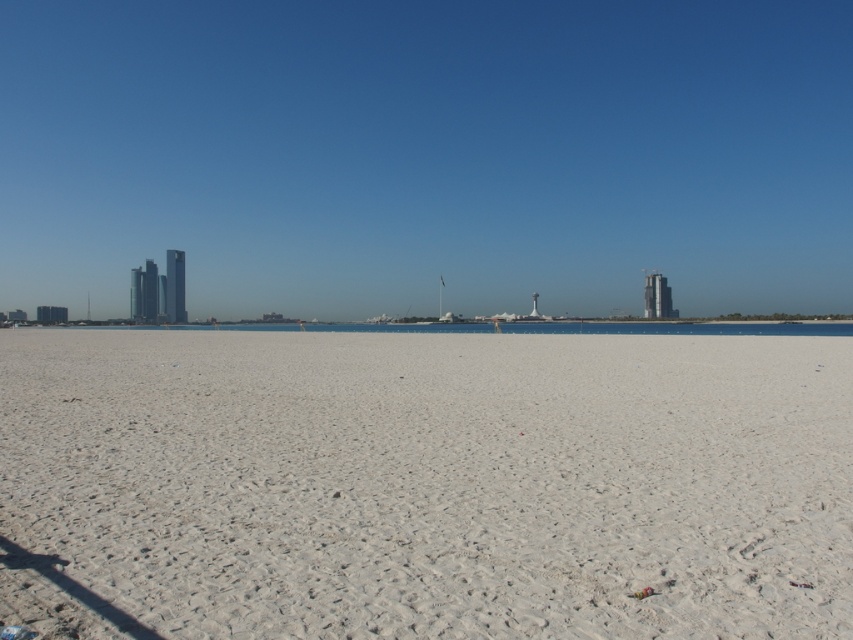
Is white sandy beach at center above clear blue water at center?

No.

Which is in front, point (161, 394) or point (234, 328)?

Positioned in front is point (161, 394).

You are a GUI agent. You are given a task and a screenshot of the screen. Output one action in this format:
    pyautogui.click(x=<x>, y=<y>)
    Task: Click on the white sandy beach at center
    This screenshot has width=853, height=640.
    Given the screenshot: What is the action you would take?
    pyautogui.click(x=427, y=483)